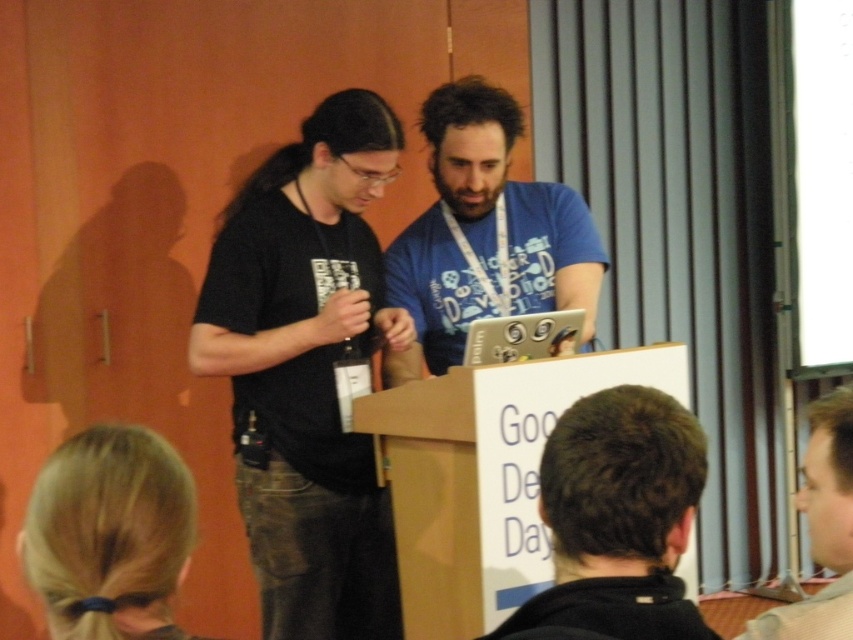
Between brown hair at back and blonde hair at lower left, which one is positioned higher?

blonde hair at lower left is above.

Locate an element on the screen. brown hair at back is located at coordinates pos(618,516).

Who is more distant from viewer, (549, 493) or (126, 547)?

Positioned behind is point (549, 493).

Where is `brown hair at back`? brown hair at back is located at coordinates (618, 516).

Does black matte t-shirt at left have a lesser width compared to light brown hair at lower right?

In fact, black matte t-shirt at left might be wider than light brown hair at lower right.

Does point (207, 307) come in front of point (814, 593)?

Yes, point (207, 307) is in front of point (814, 593).

In order to click on black matte t-shirt at left in this screenshot , I will do `click(306, 369)`.

Who is taller, black matte t-shirt at left or brown hair at back?

black matte t-shirt at left is taller.

How far apart are black matte t-shirt at left and brown hair at back?

black matte t-shirt at left and brown hair at back are 4.00 feet apart from each other.

Between point (352, 275) and point (584, 598), which one is positioned behind?

The point (352, 275) is behind.

Locate an element on the screen. The image size is (853, 640). black matte t-shirt at left is located at coordinates (306, 369).